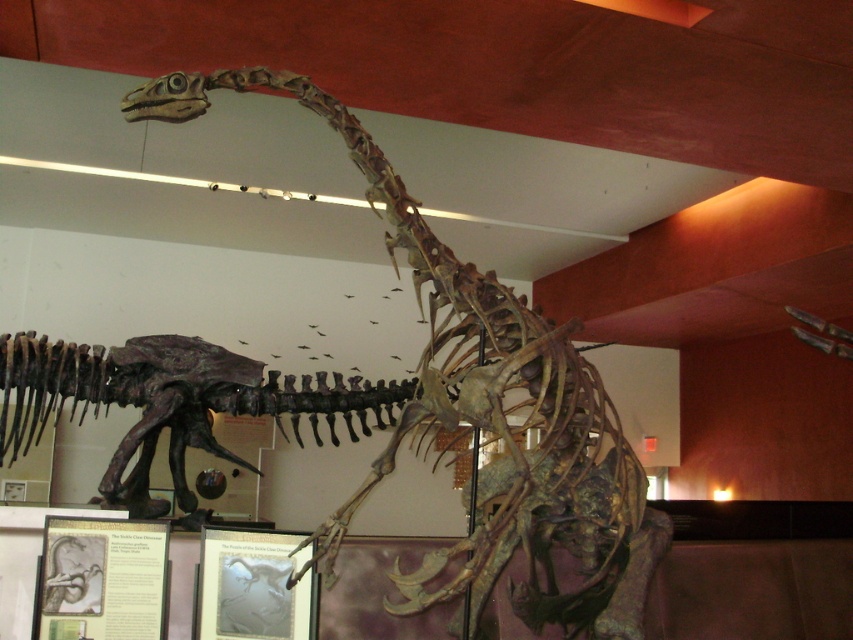
Question: In this image, where is brown bone-like dinosaur at center located relative to shiny metallic dinosaur skeleton at center?

Choices:
 (A) above
 (B) below

Answer: (A)

Question: Which of the following is the farthest from the observer?

Choices:
 (A) shiny metallic dinosaur skeleton at center
 (B) brown bone-like dinosaur at center

Answer: (A)

Question: Which of the following is the farthest from the observer?

Choices:
 (A) (524, 387)
 (B) (192, 500)

Answer: (B)

Question: From the image, what is the correct spatial relationship of brown bone-like dinosaur at center in relation to shiny metallic dinosaur skeleton at center?

Choices:
 (A) left
 (B) right

Answer: (B)

Question: Which object appears closest to the camera in this image?

Choices:
 (A) brown bone-like dinosaur at center
 (B) shiny metallic dinosaur skeleton at center

Answer: (A)

Question: Does brown bone-like dinosaur at center have a greater width compared to shiny metallic dinosaur skeleton at center?

Choices:
 (A) yes
 (B) no

Answer: (B)